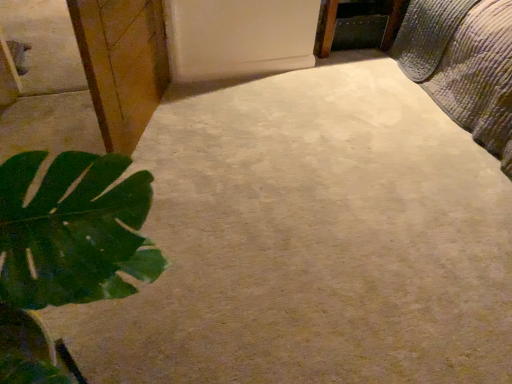
Question: Visually, is wooden cabinet at left positioned to the left or to the right of wooden frame at upper right?

Choices:
 (A) left
 (B) right

Answer: (A)

Question: From the image's perspective, is wooden cabinet at left above or below wooden frame at upper right?

Choices:
 (A) below
 (B) above

Answer: (A)

Question: Which is nearer to the textured quilted bed at upper right?

Choices:
 (A) wooden cabinet at left
 (B) wooden frame at upper right

Answer: (B)

Question: Estimate the real-world distances between objects in this image. Which object is farther from the wooden frame at upper right?

Choices:
 (A) textured quilted bed at upper right
 (B) wooden cabinet at left

Answer: (B)